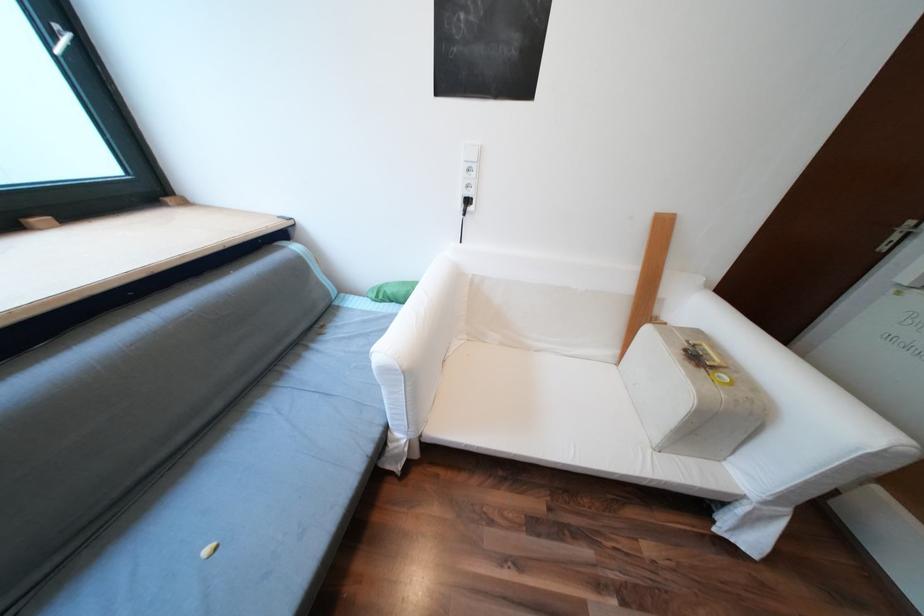
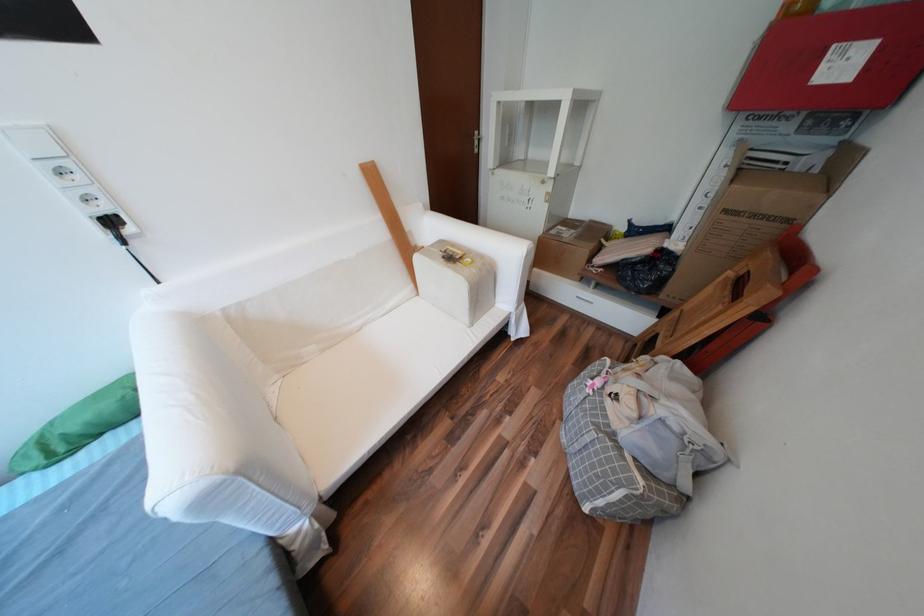
In the scene shown: The first image is from the beginning of the video and the second image is from the end. How did the camera likely rotate when shooting the video?

The rotation direction of the camera is right-down.